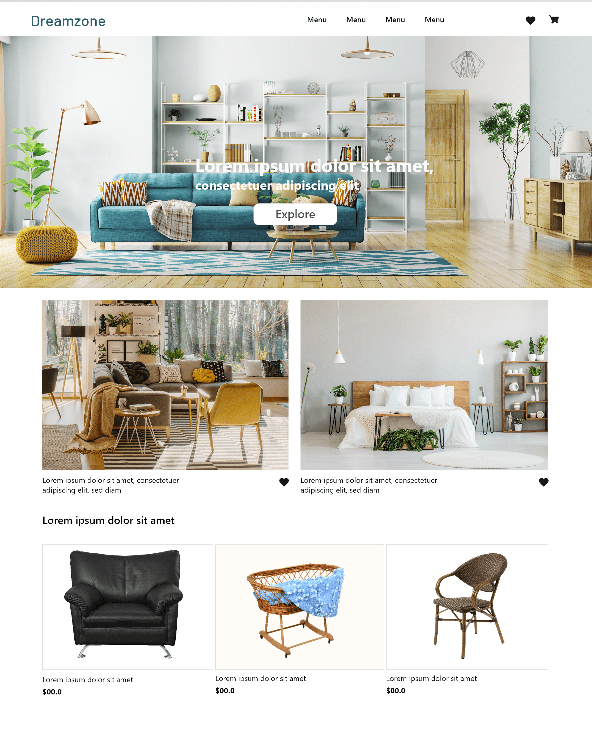
The width and height of the screenshot is (592, 750). In order to click on light fixture in this screenshot , I will do `click(96, 52)`, `click(363, 51)`, `click(336, 352)`.